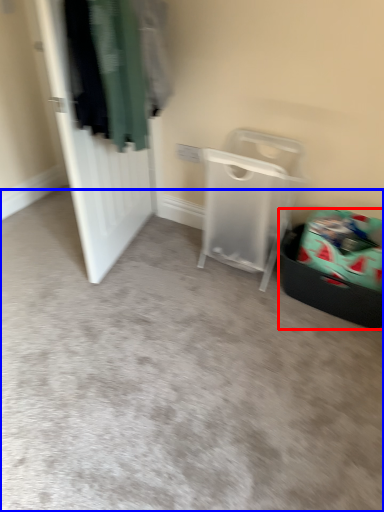
Question: Among these objects, which one is nearest to the camera, laundry basket (highlighted by a red box) or plain (highlighted by a blue box)?

Choices:
 (A) laundry basket
 (B) plain

Answer: (B)